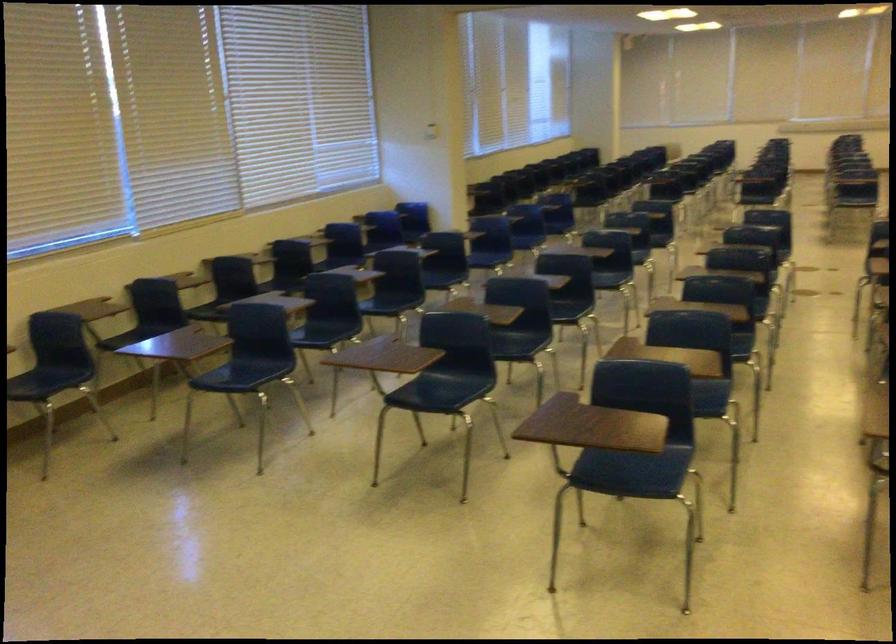
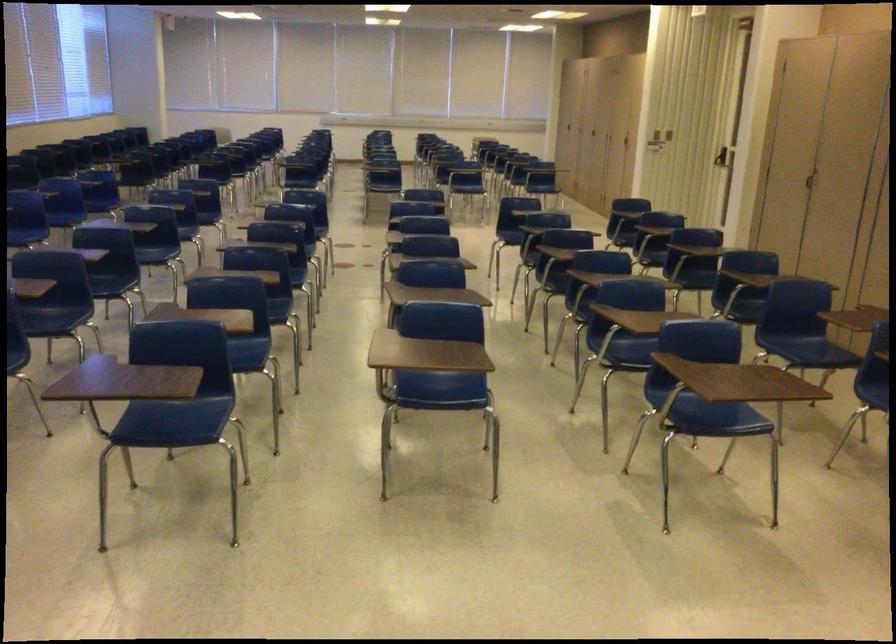
Question: The first image is from the beginning of the video and the second image is from the end. How did the camera likely rotate when shooting the video?

Choices:
 (A) Left
 (B) Right
 (C) Up
 (D) Down

Answer: (B)